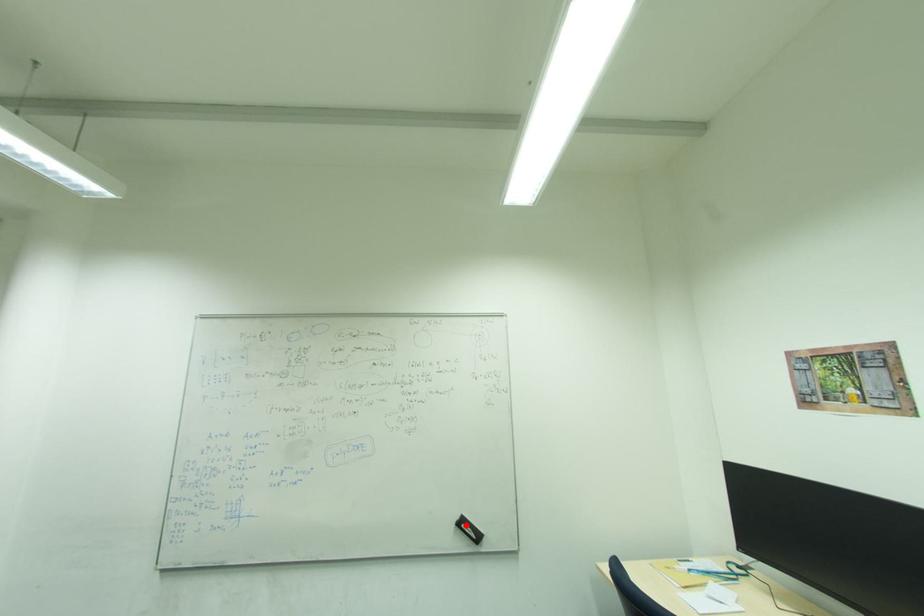
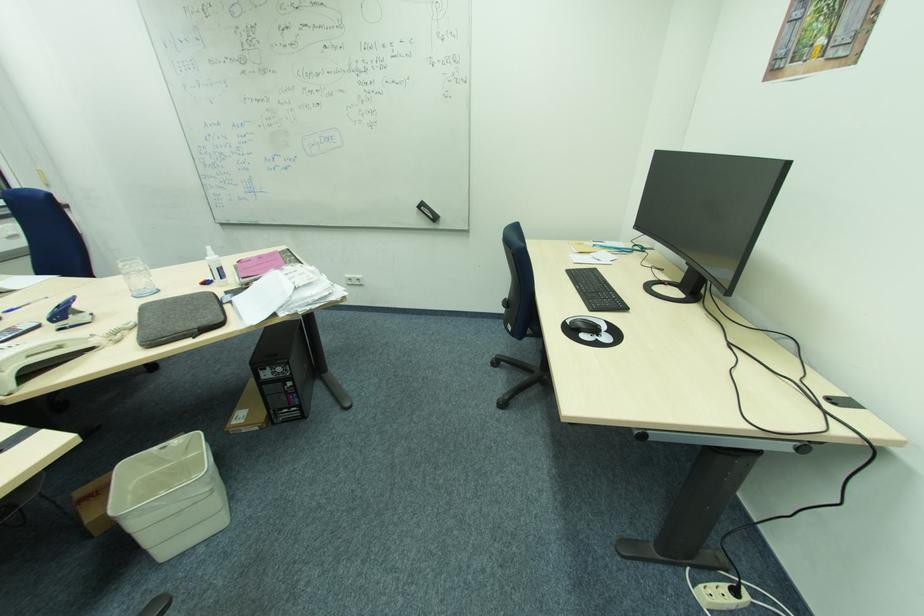
Question: I am providing you with two images of the same scene from different viewpoints. Given a red point in image1, look at the same physical point in image2. Is it:

Choices:
 (A) Closer to the viewpoint
 (B) Farther from the viewpoint

Answer: (A)